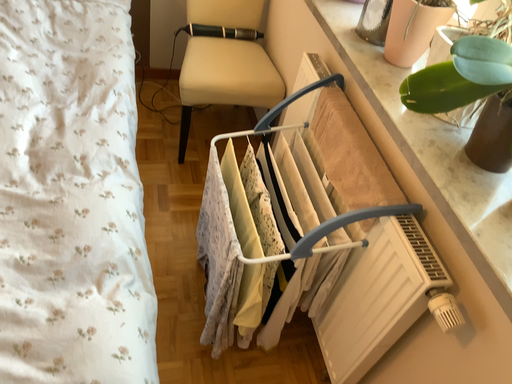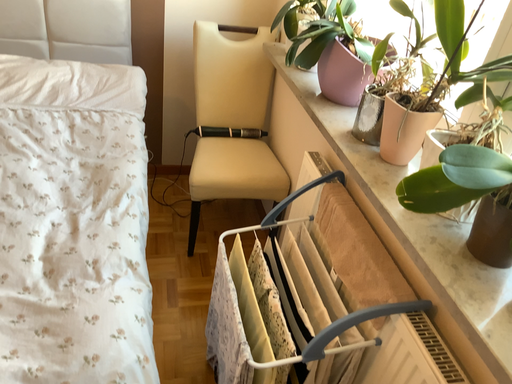
Question: How did the camera likely rotate when shooting the video?

Choices:
 (A) rotated upward
 (B) rotated downward

Answer: (A)